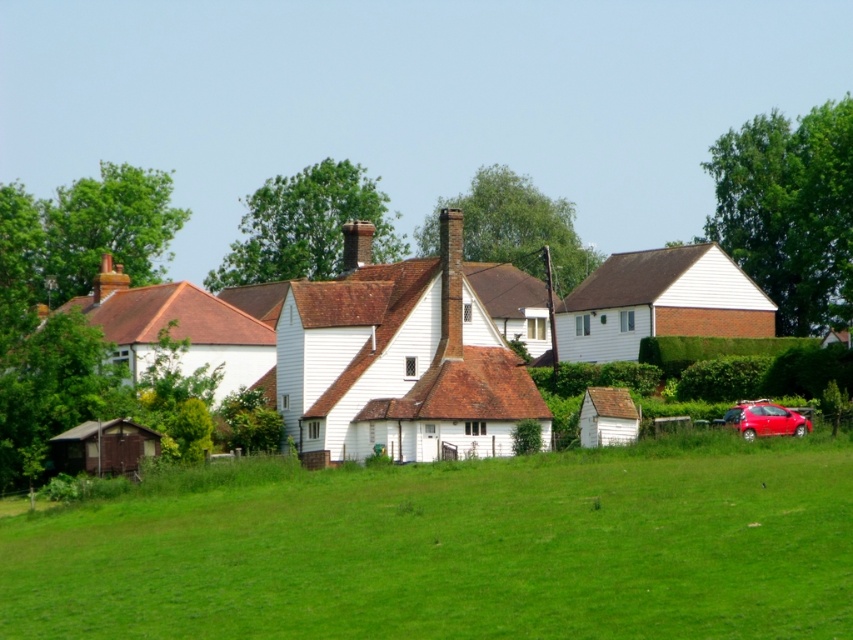
You are standing in the middle of the green grassy field looking towards the houses. You notice two green leafy trees in the upper part of the image. Which tree is closer to you, the green leafy tree at upper right or the green leafy tree at upper center?

The green leafy tree at upper right is closer to you because it is further to the viewer than the green leafy tree at upper center.

You are a bird looking for a nesting spot. You see the green leafy tree at upper right and the green leafy tree at upper center. Which tree would you choose if you want to build a nest higher up?

The green leafy tree at upper right is much taller than the green leafy tree at upper center, so you would choose the green leafy tree at upper right to build a nest higher up.

You are a drone operator trying to capture a photo of the green leafy tree at upper right. The drone is currently at the center of the image. Which direction should you move the drone to get closer to the tree?

The green leafy tree at upper right is located at point 0.331 on the x axis and 0.926 on the y axis. Since the drone is at the center, you should move it to the left and upwards to reach the tree.